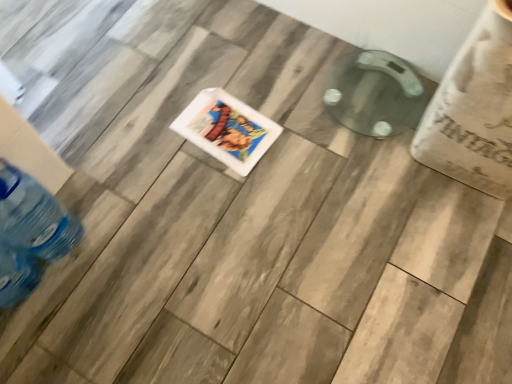
Where is `vacant area that lies between translucent plastic bottle at lower left and white glossy comic book at center`? vacant area that lies between translucent plastic bottle at lower left and white glossy comic book at center is located at coordinates (148, 188).